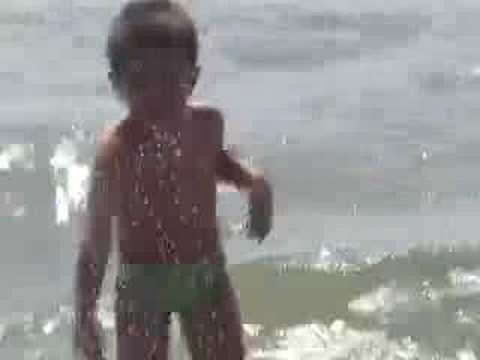
I want to click on chest, so click(x=177, y=162).